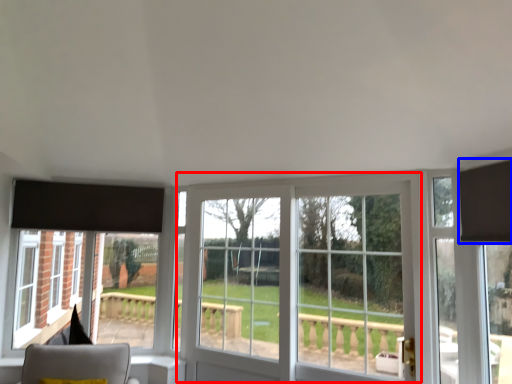
Question: Which object is further to the camera taking this photo, window (highlighted by a red box) or curtain (highlighted by a blue box)?

Choices:
 (A) window
 (B) curtain

Answer: (A)